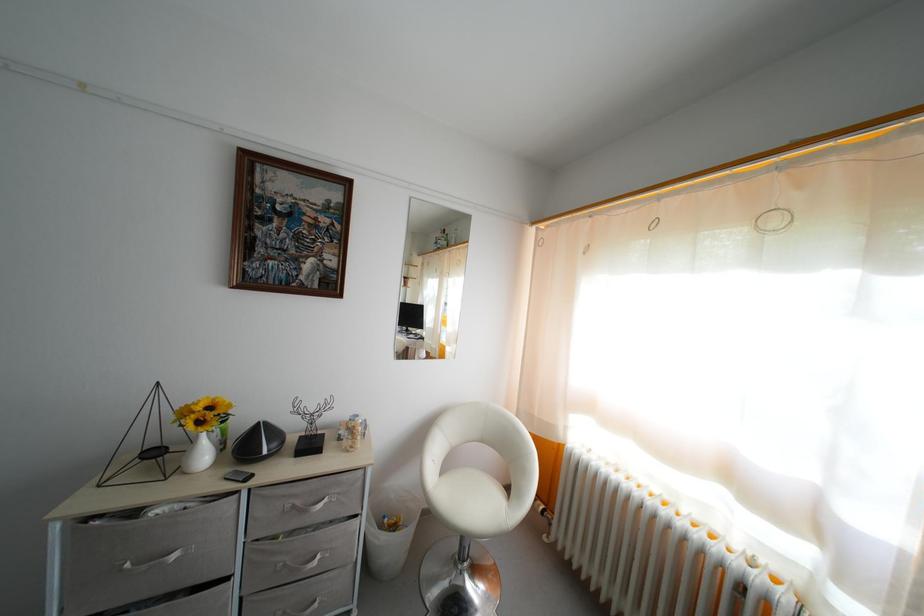
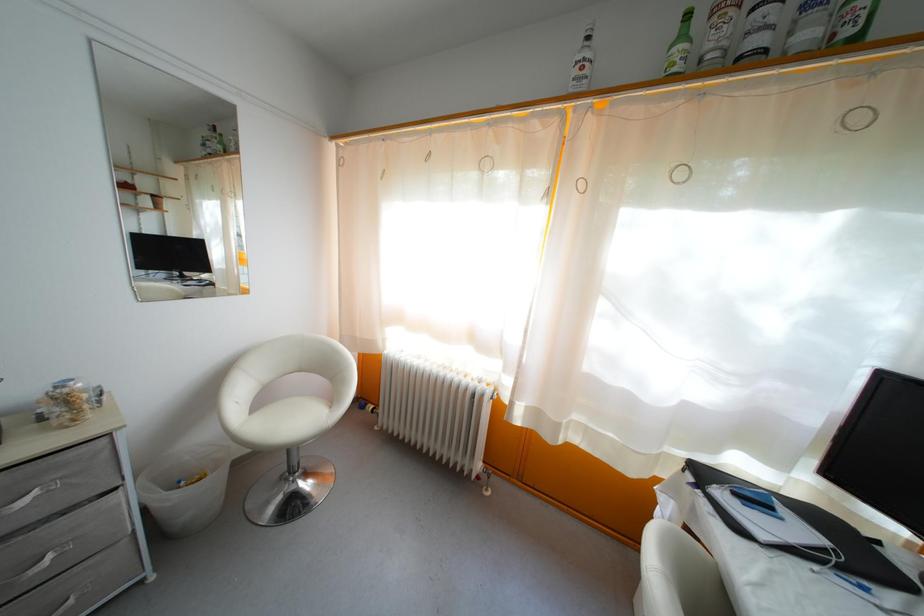
Locate, in the second image, the point that corresponds to the point at 375,544 in the first image.

(160, 512)